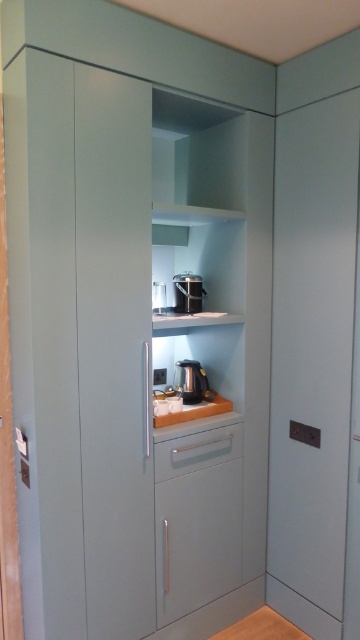
In the scene shown: You are a barista setting up a new coffee station in the kitchen. You have a satin black coffee machine at center and a satin black coffee maker at center. According to the image, which one is placed underneath the other?

The satin black coffee machine at center is positioned under the satin black coffee maker at center, so the coffee machine is underneath the coffee maker.

You are setting up a coffee station in the kitchen. You need to place the satin black coffee machine at center so that it is to the right of the orange matte counter top at center. Is this possible based on the current arrangement?

No, because the satin black coffee machine at center is currently positioned to the left of the orange matte counter top at center, so moving it to the right would require rearrangement.

You are standing in the kitchen and want to place a small bowl on the orange matte counter top at center. According to the coordinates given, where exactly should you place it?

The orange matte counter top at center is located at coordinates point (195, 412). Place the bowl there.